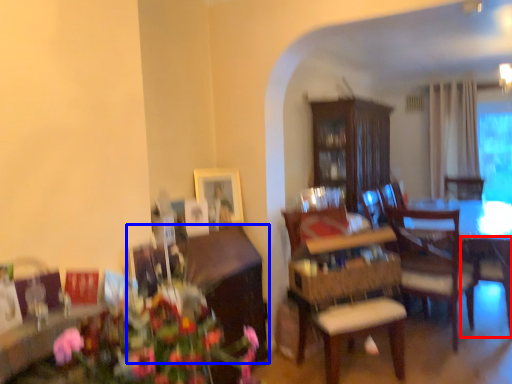
Question: Which point is closer to the camera, armchair (highlighted by a red box) or cabinetry (highlighted by a blue box)?

Choices:
 (A) armchair
 (B) cabinetry

Answer: (B)